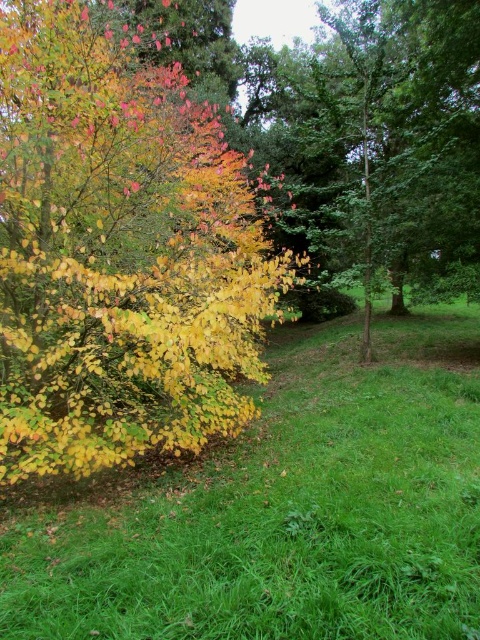
Question: From the image, what is the correct spatial relationship of green grassy at left in relation to yellow-green leaves at left?

Choices:
 (A) right
 (B) left

Answer: (A)

Question: Which point is farther to the camera?

Choices:
 (A) (168, 323)
 (B) (403, 518)

Answer: (A)

Question: Is green grassy at left wider than yellow-green leaves at left?

Choices:
 (A) no
 (B) yes

Answer: (B)

Question: Which object appears closest to the camera in this image?

Choices:
 (A) green grassy at left
 (B) yellow-green leaves at left

Answer: (A)

Question: Among these points, which one is nearest to the camera?

Choices:
 (A) (133, 506)
 (B) (191, 323)

Answer: (B)

Question: Can you confirm if green grassy at left is bigger than yellow-green leaves at left?

Choices:
 (A) no
 (B) yes

Answer: (B)